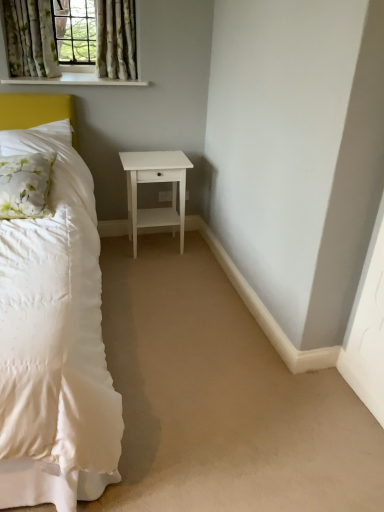
Locate an element on the screen. This screenshot has width=384, height=512. vacant region in front of white matte nightstand at center is located at coordinates (163, 273).